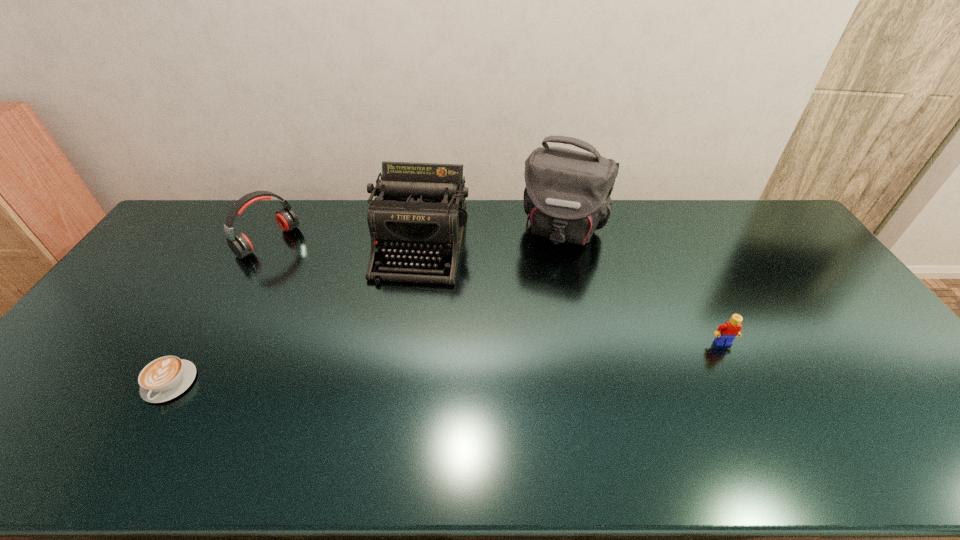
I want to click on free space between the Lego and the third object from left to right, so click(572, 294).

What are the coordinates of `vacant space that's between the fourth tallest object and the third object from left to right` in the screenshot? It's located at (572, 294).

At what (x,y) coordinates should I click in order to perform the action: click on vacant region between the third object from right to left and the tallest object. Please return your answer as a coordinate pair (x, y). The height and width of the screenshot is (540, 960). Looking at the image, I should click on (492, 237).

Find the location of a particular element. The image size is (960, 540). free area in between the third tallest object and the second nearest object is located at coordinates (495, 292).

In order to click on empty location between the third shortest object and the cappuccino in this screenshot , I will do `click(219, 312)`.

I want to click on free spot between the shoulder bag and the Lego, so click(x=643, y=286).

The image size is (960, 540). Find the location of `free spot between the earphone and the fourth shortest object`. free spot between the earphone and the fourth shortest object is located at coordinates pyautogui.click(x=345, y=243).

Select which object is the third closest to the earphone. Please provide its 2D coordinates. Your answer should be formatted as a tuple, i.e. [(x, y)], where the tuple contains the x and y coordinates of a point satisfying the conditions above.

[(567, 197)]

Identify which object is located as the second nearest to the tallest object. Please provide its 2D coordinates. Your answer should be formatted as a tuple, i.e. [(x, y)], where the tuple contains the x and y coordinates of a point satisfying the conditions above.

[(726, 333)]